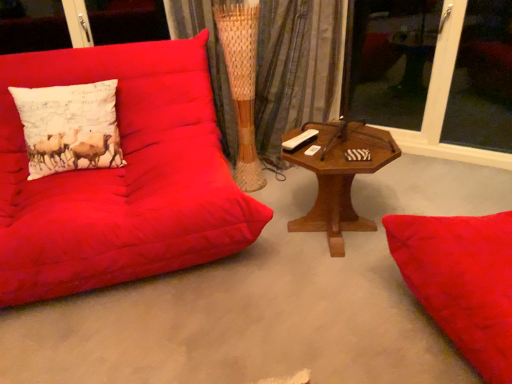
Question: Is white printed cushion at left situated inside transparent glass window at upper right, marked as the 2th window screen in a right-to-left arrangement, or outside?

Choices:
 (A) inside
 (B) outside

Answer: (B)

Question: Relative to transparent glass window at upper right, the 1th window screen when ordered from left to right, is white printed cushion at left in front or behind?

Choices:
 (A) behind
 (B) front

Answer: (B)

Question: Which is nearer to the matte red couch at left?

Choices:
 (A) transparent glass window at upper right, the 1th window screen when ordered from left to right
 (B) transparent glass window at upper right, the 2th window screen from the left
 (C) woven fabric curtain at center
 (D) woodenobject at center
 (E) white printed cushion at left

Answer: (E)

Question: Estimate the real-world distances between objects in this image. Which object is farther from the white printed cushion at left?

Choices:
 (A) woodenobject at center
 (B) transparent glass window at upper right, the 1th window screen when ordered from left to right
 (C) woven fabric curtain at center
 (D) matte red couch at left
 (E) transparent glass window at upper right, which ranks as the 1th window screen in right-to-left order

Answer: (B)